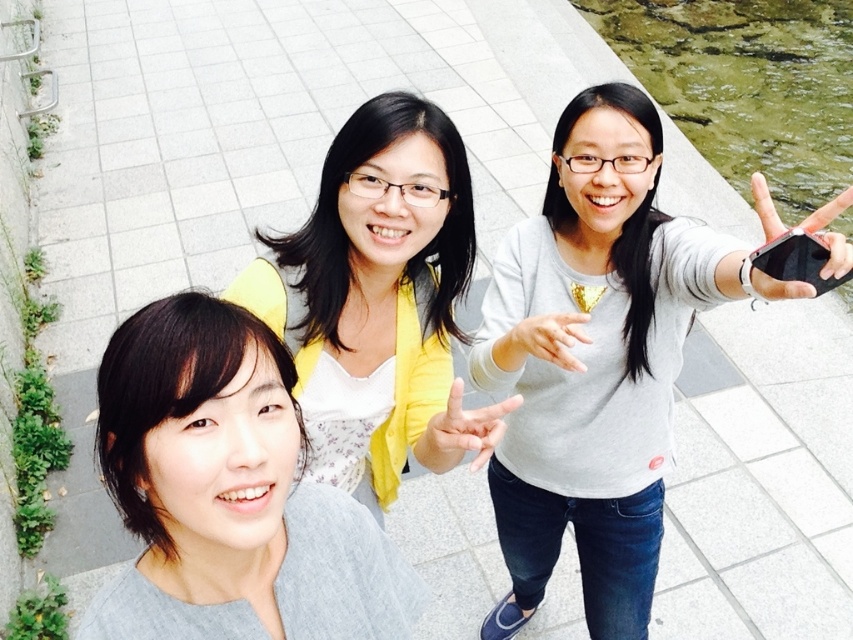
Question: Does matte yellow hand at center have a smaller size compared to matte gray hand at center?

Choices:
 (A) no
 (B) yes

Answer: (A)

Question: Which of the following is the closest to the observer?

Choices:
 (A) matte yellow hand at center
 (B) black matte phone at upper right

Answer: (B)

Question: Which point appears farthest from the camera in this image?

Choices:
 (A) (445, 467)
 (B) (281, 588)

Answer: (A)

Question: Can you confirm if matte yellow cardigan at center is wider than matte yellow hand at center?

Choices:
 (A) no
 (B) yes

Answer: (B)

Question: Does gray matte shirt at lower left lie in front of matte yellow hand at center?

Choices:
 (A) no
 (B) yes

Answer: (B)

Question: Estimate the real-world distances between objects in this image. Which object is closer to the matte yellow cardigan at center?

Choices:
 (A) black matte phone at upper right
 (B) clear glass water at upper right
 (C) gray matte shirt at center
 (D) gray matte shirt at lower left

Answer: (C)